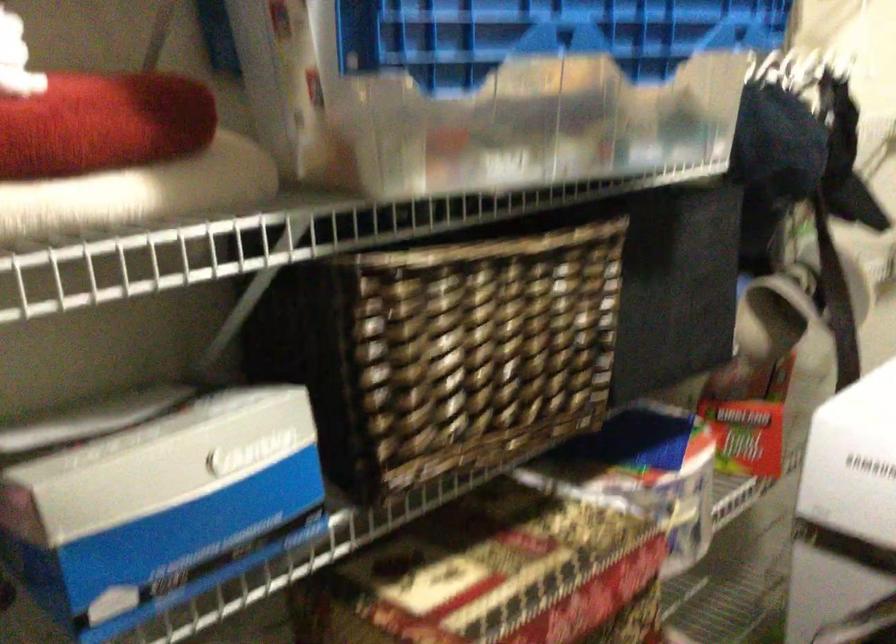
Find where to pull the patterned storage box. Please return your answer as a coordinate pair (x, y).

(504, 567)